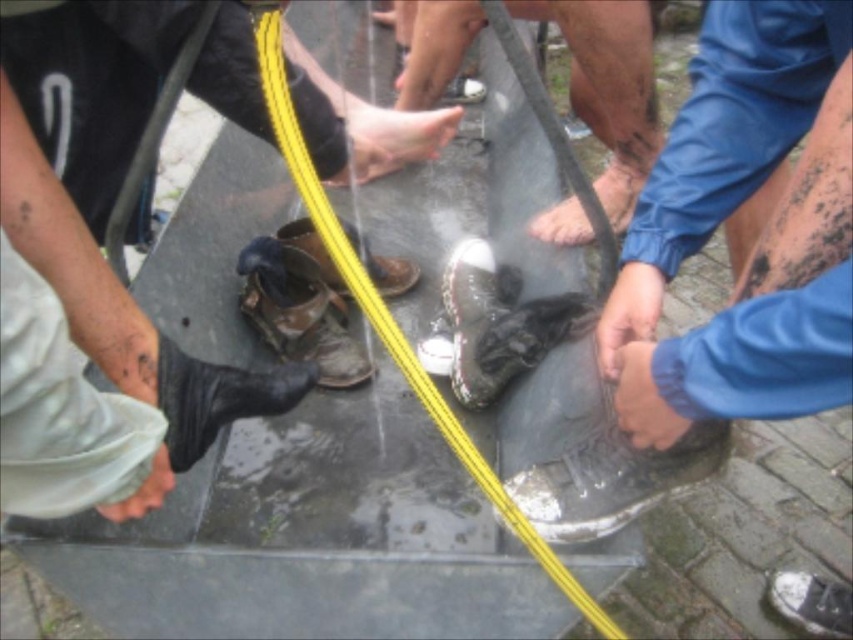
Question: Which object appears closest to the camera in this image?

Choices:
 (A) smooth skin foot at center
 (B) camouflage fabric boot at lower left

Answer: (A)

Question: Which object appears farthest from the camera in this image?

Choices:
 (A) black rubber boot at left
 (B) black rubber boot at lower left
 (C) dark skin foot at center

Answer: (C)

Question: Which point is farther to the camera?

Choices:
 (A) tap(817, 604)
 (B) tap(473, 97)
 (C) tap(581, 467)
 (D) tap(51, 200)

Answer: (B)

Question: Is black rubber boot at lower left positioned before brown leather shoe at center?

Choices:
 (A) yes
 (B) no

Answer: (A)

Question: Is smooth skin foot at center in front of camouflage fabric boot at lower left?

Choices:
 (A) yes
 (B) no

Answer: (A)

Question: Does dark skin foot at center appear on the left side of brown leather shoe at center?

Choices:
 (A) yes
 (B) no

Answer: (B)